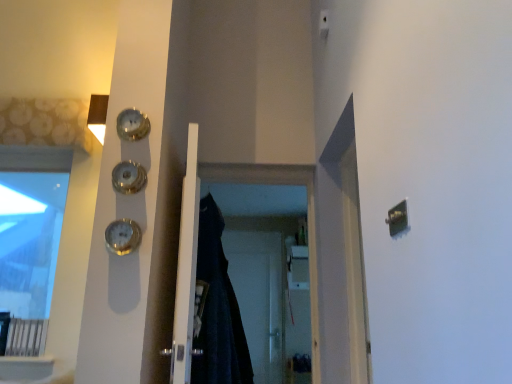
Question: Is shiny gold clock at upper left, the second clock when ordered from top to bottom, taller than gold metallic clock at left, which is the first clock in bottom-to-top order?

Choices:
 (A) yes
 (B) no

Answer: (A)

Question: Does shiny gold clock at upper left, which is the 2th clock in bottom-to-top order, have a lesser width compared to gold metallic clock at left, which is the first clock in bottom-to-top order?

Choices:
 (A) no
 (B) yes

Answer: (A)

Question: Considering the relative sizes of shiny gold clock at upper left, which is the 2th clock in bottom-to-top order, and gold metallic clock at left, which is the first clock in bottom-to-top order, in the image provided, is shiny gold clock at upper left, which is the 2th clock in bottom-to-top order, wider than gold metallic clock at left, which is the first clock in bottom-to-top order,?

Choices:
 (A) no
 (B) yes

Answer: (B)

Question: From a real-world perspective, is shiny gold clock at upper left, the second clock when ordered from top to bottom, located higher than gold metallic clock at left, which is the first clock in bottom-to-top order?

Choices:
 (A) no
 (B) yes

Answer: (B)

Question: Would you consider shiny gold clock at upper left, which is the 2th clock in bottom-to-top order, to be distant from gold metallic clock at left, which is the first clock in bottom-to-top order?

Choices:
 (A) no
 (B) yes

Answer: (A)

Question: Is shiny gold clock at upper left, which is the 2th clock in bottom-to-top order, outside of gold metallic clock at left, which ranks as the 3th clock in top-to-bottom order?

Choices:
 (A) no
 (B) yes

Answer: (B)

Question: Considering the relative sizes of transparent glass window at upper left and white plastic light switch at upper center in the image provided, is transparent glass window at upper left wider than white plastic light switch at upper center?

Choices:
 (A) yes
 (B) no

Answer: (A)

Question: From the image's perspective, would you say transparent glass window at upper left is positioned over white plastic light switch at upper center?

Choices:
 (A) yes
 (B) no

Answer: (B)

Question: Can you confirm if transparent glass window at upper left is thinner than white plastic light switch at upper center?

Choices:
 (A) yes
 (B) no

Answer: (B)

Question: Is transparent glass window at upper left aimed at white plastic light switch at upper center?

Choices:
 (A) no
 (B) yes

Answer: (A)

Question: Considering the relative sizes of transparent glass window at upper left and white plastic light switch at upper center in the image provided, is transparent glass window at upper left taller than white plastic light switch at upper center?

Choices:
 (A) no
 (B) yes

Answer: (B)

Question: Are transparent glass window at upper left and white plastic light switch at upper center making contact?

Choices:
 (A) no
 (B) yes

Answer: (A)

Question: From the image's perspective, is shiny gold clock at upper left, the second clock when ordered from top to bottom, below black fabric screen door at center, which appears as the second screen door when viewed from the back?

Choices:
 (A) yes
 (B) no

Answer: (B)